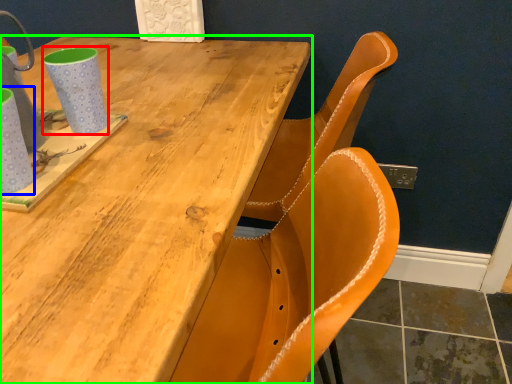
Question: Which object is positioned farthest from mug (highlighted by a red box)? Select from mug (highlighted by a blue box) and table (highlighted by a green box).

Choices:
 (A) mug
 (B) table

Answer: (B)